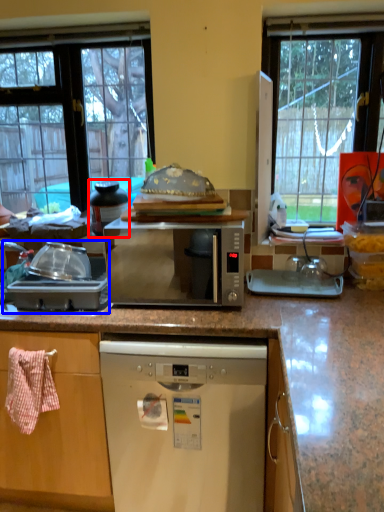
Question: Which point is closer to the camera, appliance (highlighted by a red box) or appliance (highlighted by a blue box)?

Choices:
 (A) appliance
 (B) appliance

Answer: (B)